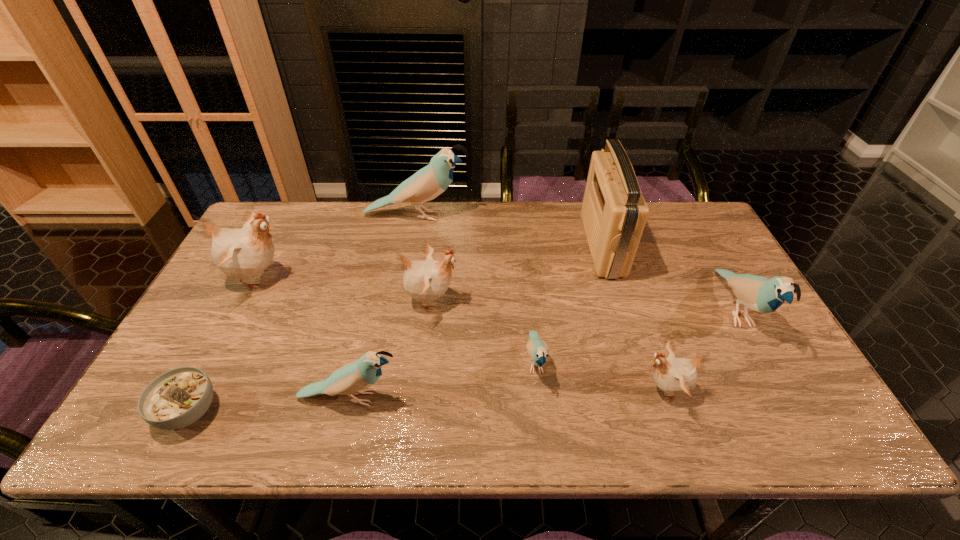
Where is `bird at the left edge`? The image size is (960, 540). bird at the left edge is located at coordinates (242, 253).

Find the location of a particular element. This screenshot has width=960, height=540. soup bowl present at the left edge is located at coordinates (179, 397).

Image resolution: width=960 pixels, height=540 pixels. Find the location of `object at the right edge`. object at the right edge is located at coordinates (757, 293).

You are a GUI agent. You are given a task and a screenshot of the screen. Output one action in this format:
    pyautogui.click(x=<x>, y=<y>)
    Task: Click on the object at the near left corner
    The width and height of the screenshot is (960, 540).
    Given the screenshot: What is the action you would take?
    pyautogui.click(x=179, y=397)

In the image, there is a desktop. Identify the location of vacant region at the far edge. The width and height of the screenshot is (960, 540). (446, 240).

Where is `vacant region at the near edge of the desktop`? vacant region at the near edge of the desktop is located at coordinates (364, 407).

The height and width of the screenshot is (540, 960). In order to click on free location at the left edge in this screenshot , I will do `click(207, 376)`.

Identify the location of vacant space at the right edge of the desktop. 757,402.

The image size is (960, 540). Identify the location of vacant space at the far left corner of the desktop. (288, 242).

This screenshot has width=960, height=540. Identify the location of free space at the near right corner. (765, 418).